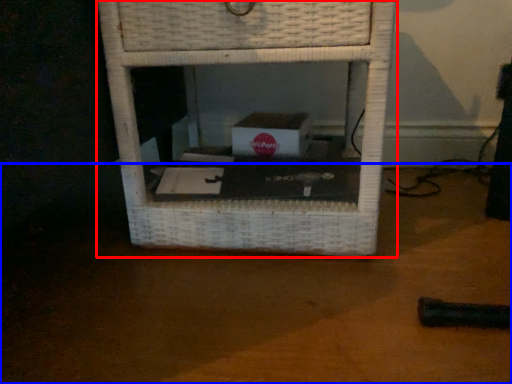
Question: Which object is closer to the camera taking this photo, furniture (highlighted by a red box) or table top (highlighted by a blue box)?

Choices:
 (A) furniture
 (B) table top

Answer: (B)